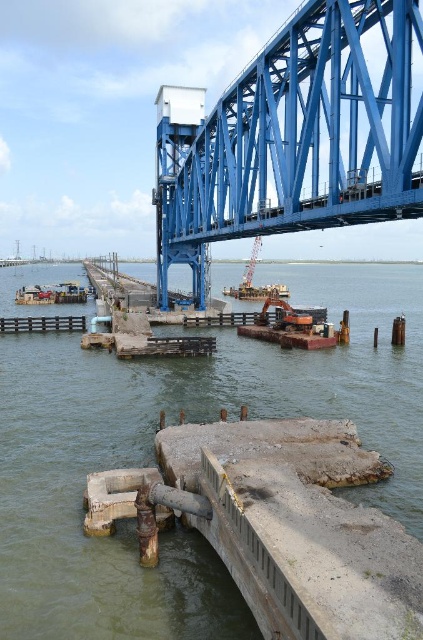
Does gray concrete water at center appear on the left side of blue metallic bridge at upper center?

Yes, gray concrete water at center is to the left of blue metallic bridge at upper center.

Does gray concrete water at center come behind blue metallic bridge at upper center?

Yes, it is behind blue metallic bridge at upper center.

Find the location of a particular element. gray concrete water at center is located at coordinates (153, 456).

Can you confirm if gray concrete water at center is wider than rustic wood dock at lower left?

Yes.

Locate an element on the screen. gray concrete water at center is located at coordinates point(153,456).

Is point (318, 392) positioned after point (16, 321)?

No, it is in front of (16, 321).

You are a GUI agent. You are given a task and a screenshot of the screen. Output one action in this format:
    pyautogui.click(x=<x>, y=<y>)
    Task: Click on the gray concrete water at center
    The image size is (423, 640).
    Given the screenshot: What is the action you would take?
    pyautogui.click(x=153, y=456)

Between blue metallic bridge at upper center and metallic gray crane at center, which one has less height?

Standing shorter between the two is metallic gray crane at center.

Is blue metallic bridge at upper center closer to camera compared to metallic gray crane at center?

Yes, it is.

Find the location of `blue metallic bridge at upper center`. blue metallic bridge at upper center is located at coordinates (294, 136).